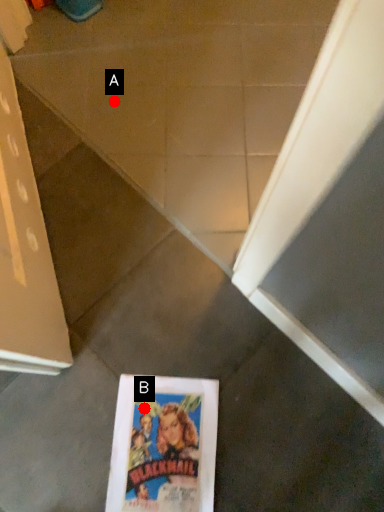
Question: Two points are circled on the image, labeled by A and B beside each circle. Which point is closer to the camera?

Choices:
 (A) A is closer
 (B) B is closer

Answer: (B)